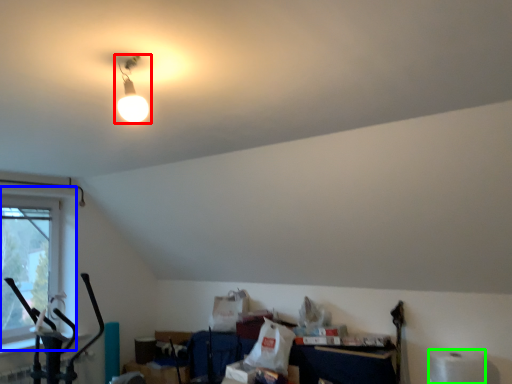
Question: Based on their relative distances, which object is nearer to lamp (highlighted by a red box)? Choose from window (highlighted by a blue box) and toilet paper (highlighted by a green box).

Choices:
 (A) window
 (B) toilet paper

Answer: (A)